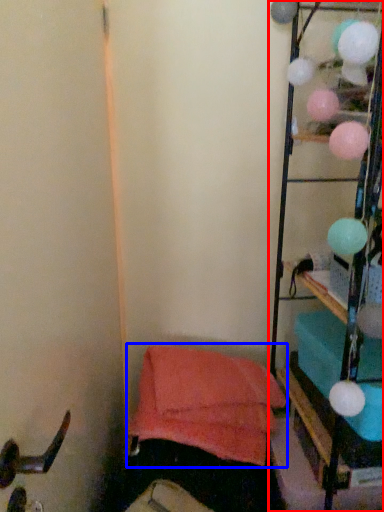
Question: Which object is closer to the camera taking this photo, furniture (highlighted by a red box) or bean bag chair (highlighted by a blue box)?

Choices:
 (A) furniture
 (B) bean bag chair

Answer: (A)